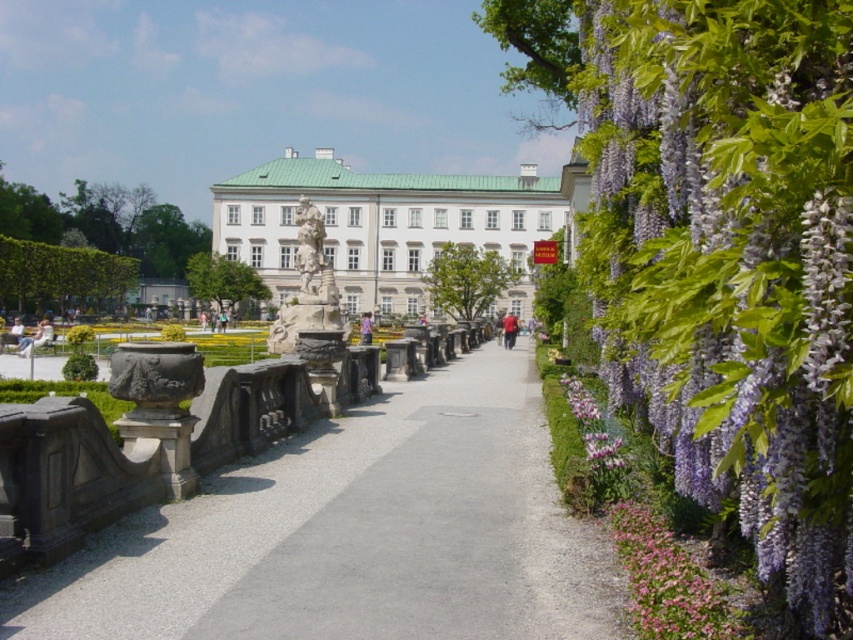
Question: Can you confirm if purple silky wisteria at right is smaller than green leafy hedge at left?

Choices:
 (A) no
 (B) yes

Answer: (B)

Question: Which of the following is the closest to the observer?

Choices:
 (A) (480, 396)
 (B) (33, 273)

Answer: (A)

Question: Which point is closer to the camera taking this photo?

Choices:
 (A) (212, 198)
 (B) (785, 172)
 (C) (581, 604)
 (D) (318, 301)

Answer: (B)

Question: Is gray gravel path at center closer to the viewer compared to white glossy palace at center?

Choices:
 (A) yes
 (B) no

Answer: (A)

Question: Where is white glossy palace at center located in relation to white marble statue at center in the image?

Choices:
 (A) above
 (B) below

Answer: (A)

Question: Estimate the real-world distances between objects in this image. Which object is farther from the white marble statue at center?

Choices:
 (A) green leafy hedge at left
 (B) purple silky wisteria at right
 (C) white glossy palace at center

Answer: (A)